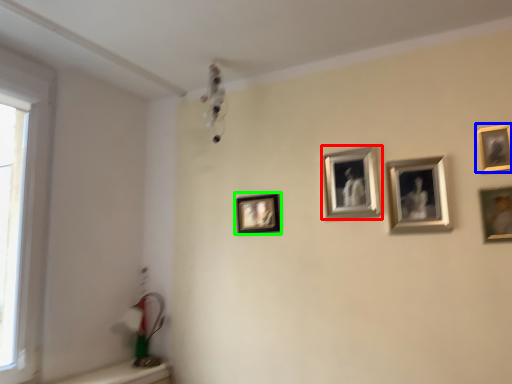
Question: Which object is positioned closest to picture frame (highlighted by a red box)? Select from picture frame (highlighted by a blue box) and picture frame (highlighted by a green box).

Choices:
 (A) picture frame
 (B) picture frame

Answer: (B)